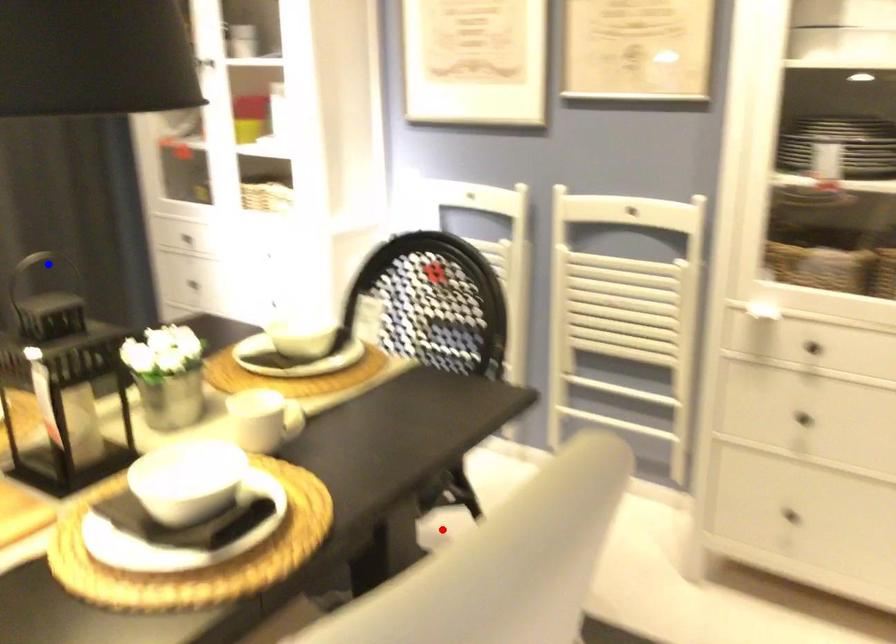
Question: In the image, two points are highlighted. Which point is nearer to the camera? Reply with the corresponding letter.

Choices:
 (A) blue point
 (B) red point

Answer: (B)